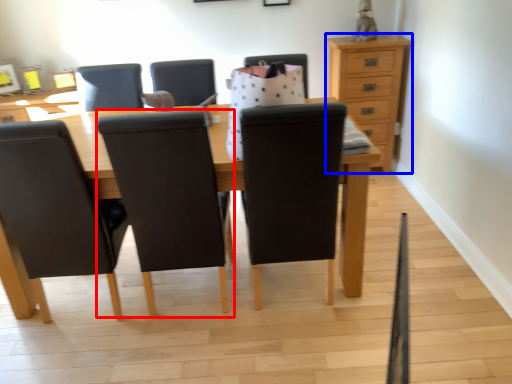
Question: Which object is further to the camera taking this photo, chair (highlighted by a red box) or chest of drawers (highlighted by a blue box)?

Choices:
 (A) chair
 (B) chest of drawers

Answer: (B)